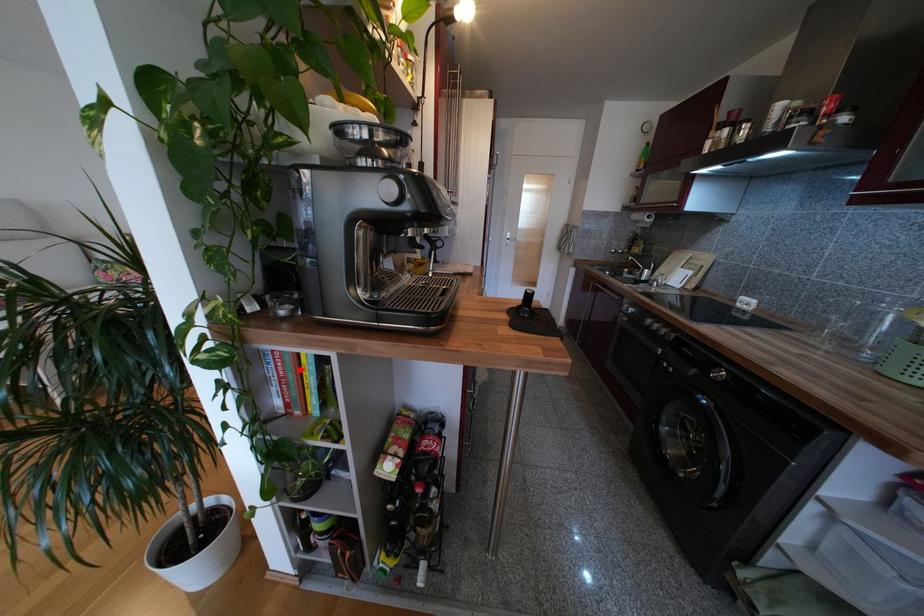
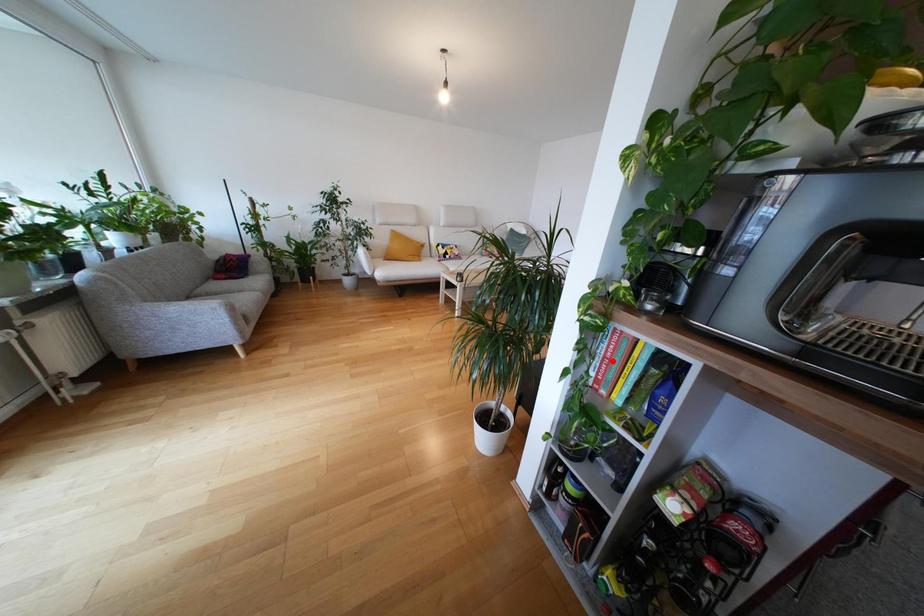
I am providing you with two images of the same scene from different viewpoints. A red point is marked on the first image and another point is marked on the second image. Does the point marked in image1 correspond to the same location as the one in image2?

No